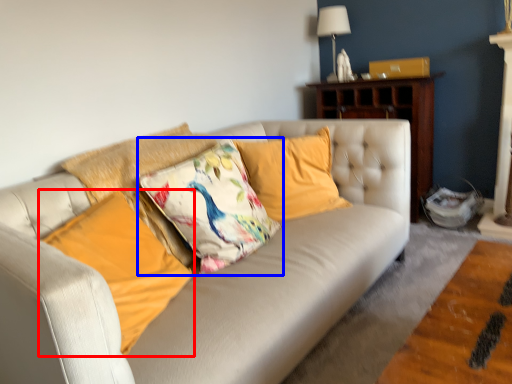
Question: Which object is further to the camera taking this photo, pillow (highlighted by a red box) or pillow (highlighted by a blue box)?

Choices:
 (A) pillow
 (B) pillow

Answer: (B)